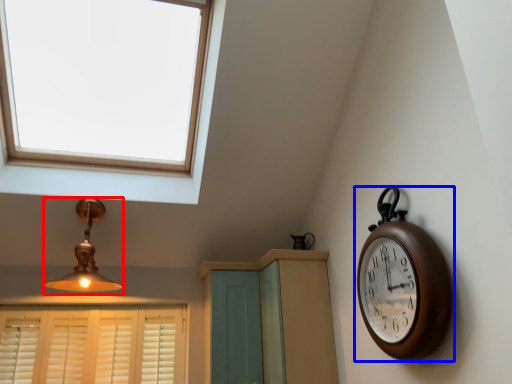
Question: Among these objects, which one is nearest to the camera, lamp (highlighted by a red box) or wall clock (highlighted by a blue box)?

Choices:
 (A) lamp
 (B) wall clock

Answer: (B)